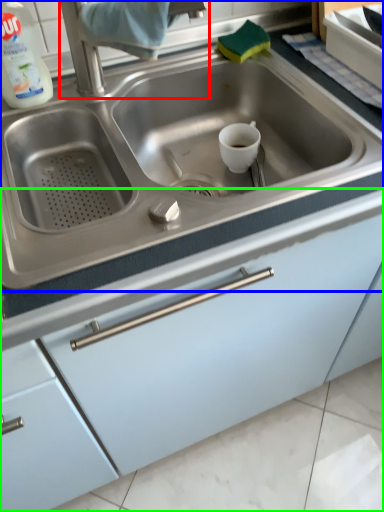
Question: Estimate the real-world distances between objects in this image. Which object is farther from faucet (highlighted by a red box), sink (highlighted by a blue box) or cabinetry (highlighted by a green box)?

Choices:
 (A) sink
 (B) cabinetry

Answer: (B)